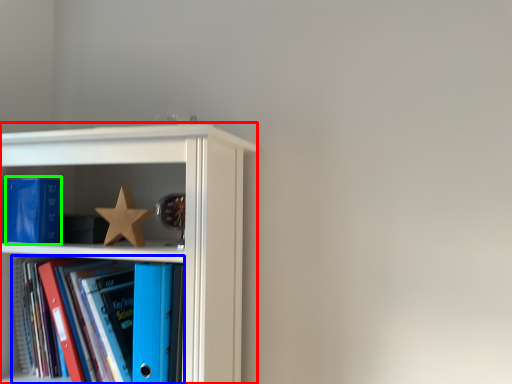
Question: Which object is the farthest from shelf (highlighted by a red box)? Choose among these: book (highlighted by a blue box) or paperback book (highlighted by a green box).

Choices:
 (A) book
 (B) paperback book

Answer: (B)